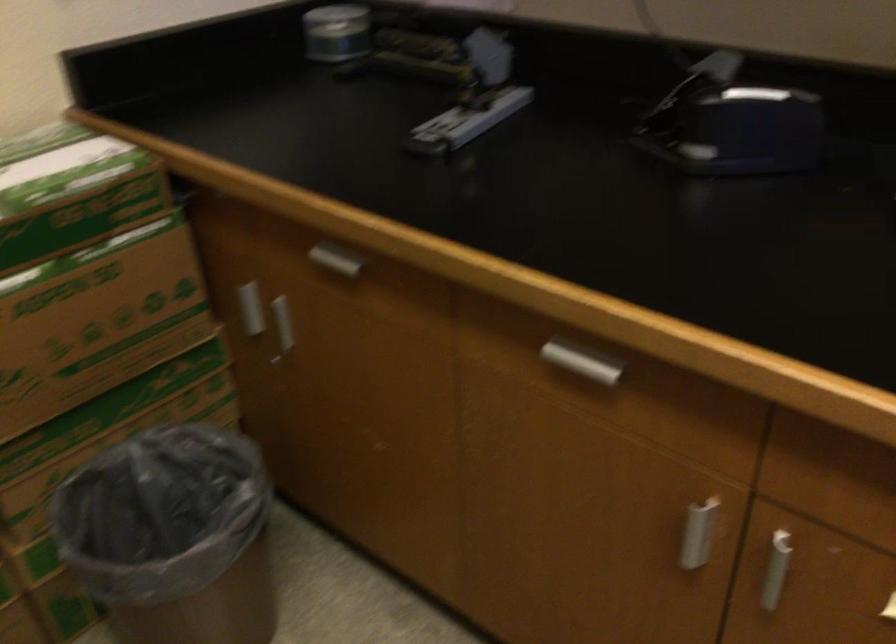
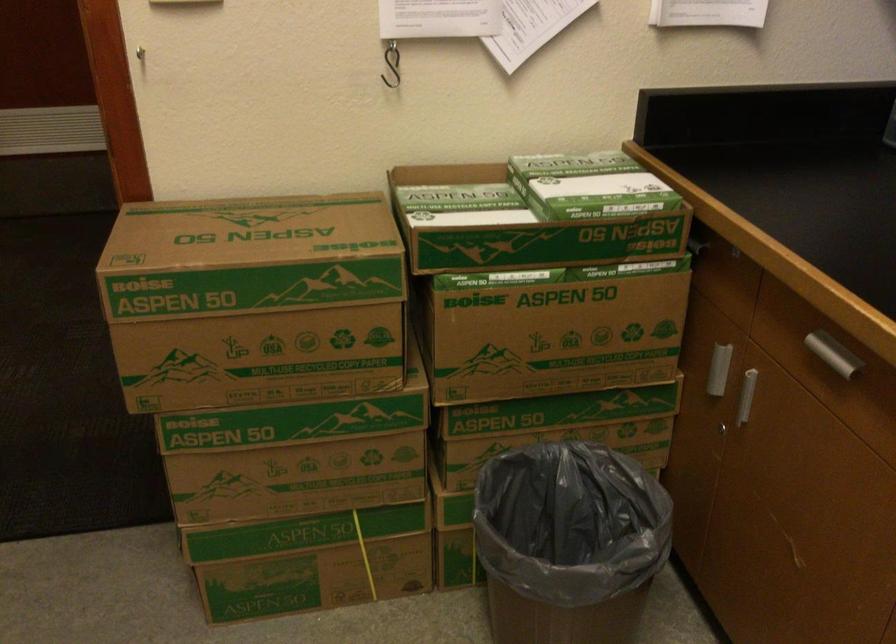
Find the pixel in the second image that matches (76,334) in the first image.

(552, 337)